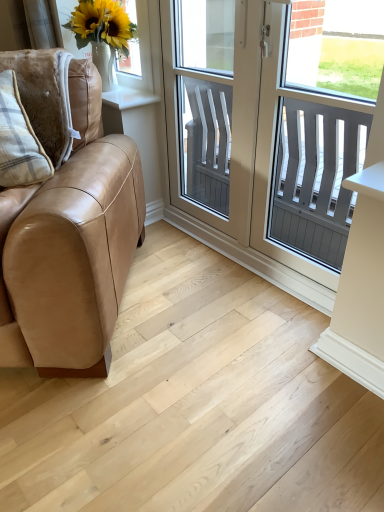
Question: From the image's perspective, is light wood floor at lower left on top of white plastic window at center?

Choices:
 (A) no
 (B) yes

Answer: (A)

Question: From a real-world perspective, is light wood floor at lower left on top of white plastic window at center?

Choices:
 (A) yes
 (B) no

Answer: (B)

Question: Can you confirm if light wood floor at lower left is positioned to the left of white plastic window at center?

Choices:
 (A) no
 (B) yes

Answer: (B)

Question: Does light wood floor at lower left lie in front of white plastic window at center?

Choices:
 (A) yes
 (B) no

Answer: (A)

Question: Can you confirm if light wood floor at lower left is bigger than white plastic window at center?

Choices:
 (A) no
 (B) yes

Answer: (B)

Question: From a real-world perspective, is tan leather couch at left positioned above or below light wood floor at lower left?

Choices:
 (A) above
 (B) below

Answer: (A)

Question: Visually, is tan leather couch at left positioned to the left or to the right of light wood floor at lower left?

Choices:
 (A) right
 (B) left

Answer: (B)

Question: From the image's perspective, relative to light wood floor at lower left, is tan leather couch at left above or below?

Choices:
 (A) above
 (B) below

Answer: (A)

Question: Is tan leather couch at left inside or outside of light wood floor at lower left?

Choices:
 (A) outside
 (B) inside

Answer: (A)

Question: From the image's perspective, is white plastic window at center above or below plaid fabric pillow at left?

Choices:
 (A) below
 (B) above

Answer: (B)

Question: Is white plastic window at center in front of or behind plaid fabric pillow at left in the image?

Choices:
 (A) behind
 (B) front

Answer: (B)

Question: In terms of width, does white plastic window at center look wider or thinner when compared to plaid fabric pillow at left?

Choices:
 (A) thin
 (B) wide

Answer: (A)

Question: Considering the positions of white plastic window at center and plaid fabric pillow at left in the image, is white plastic window at center taller or shorter than plaid fabric pillow at left?

Choices:
 (A) short
 (B) tall

Answer: (B)

Question: From the image's perspective, is white plastic window at center above or below tan leather couch at left?

Choices:
 (A) below
 (B) above

Answer: (B)

Question: Would you say white plastic window at center is to the left or to the right of tan leather couch at left in the picture?

Choices:
 (A) left
 (B) right

Answer: (B)